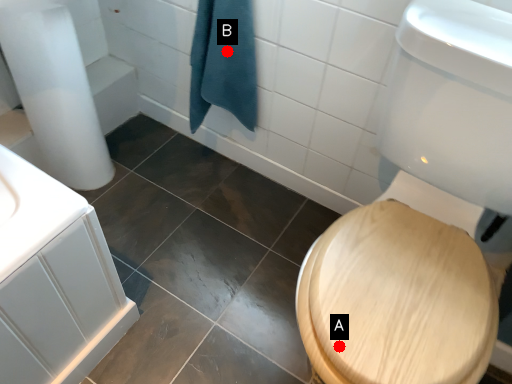
Question: Two points are circled on the image, labeled by A and B beside each circle. Which point appears closest to the camera in this image?

Choices:
 (A) A is closer
 (B) B is closer

Answer: (A)